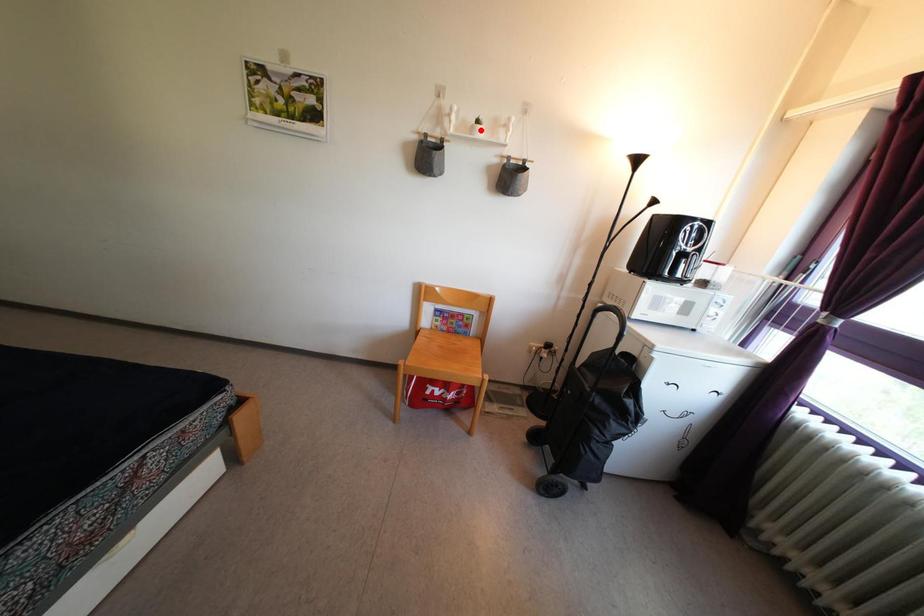
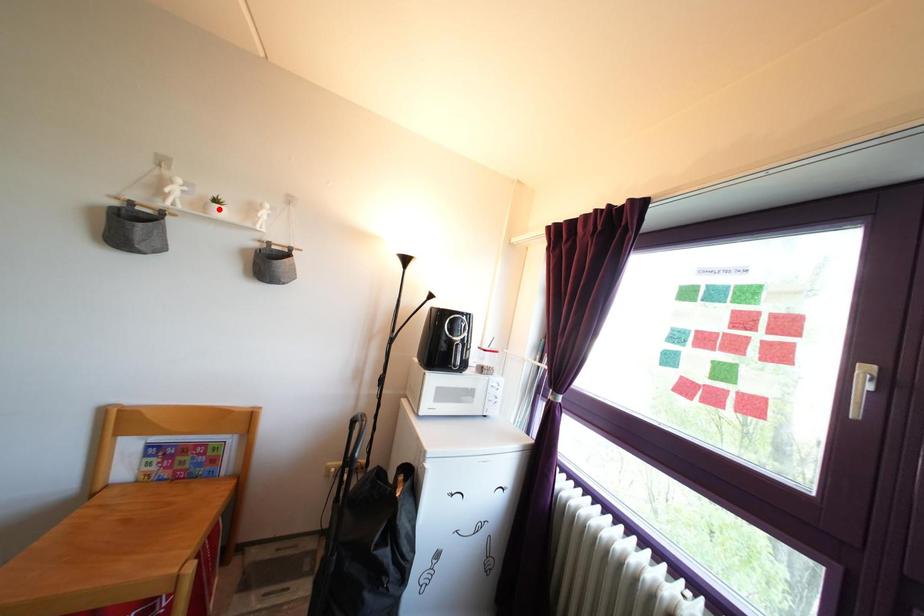
I am providing you with two images of the same scene from different viewpoints. A red point is marked on the first image and another point is marked on the second image. Do the highlighted points in image1 and image2 indicate the same real-world spot?

Yes